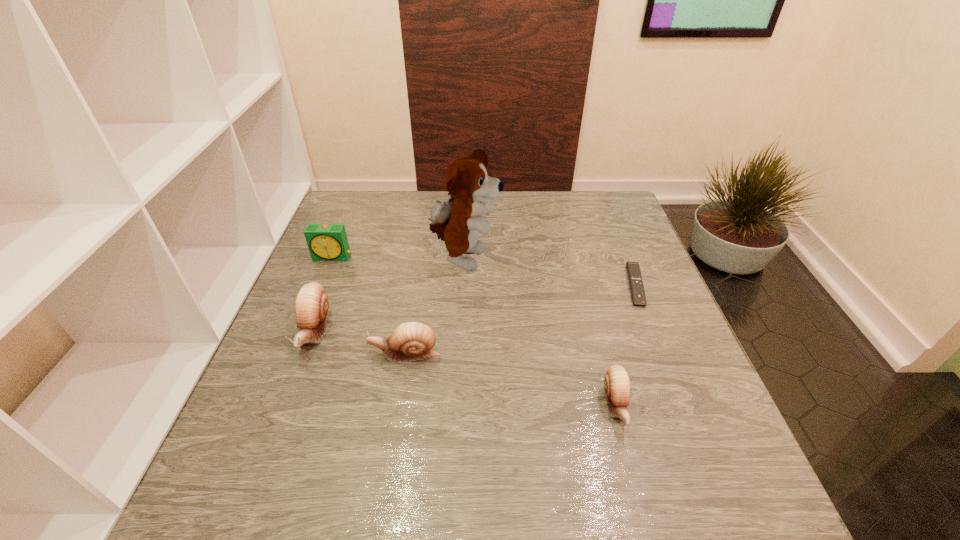
The width and height of the screenshot is (960, 540). What are the coordinates of `free space located on the front-facing side of the second escargot from left to right` in the screenshot? It's located at pyautogui.click(x=272, y=354).

Locate an element on the screen. The height and width of the screenshot is (540, 960). free space located 0.120m on the front-facing side of the second escargot from left to right is located at coordinates (314, 354).

Locate an element on the screen. free region located 0.370m on the front-facing side of the alarm clock is located at coordinates (284, 375).

Locate an element on the screen. free region located 0.200m on the face of the tallest object is located at coordinates click(x=575, y=260).

Find the location of `free location located 0.060m on the left of the remote control`. free location located 0.060m on the left of the remote control is located at coordinates (602, 286).

You are a GUI agent. You are given a task and a screenshot of the screen. Output one action in this format:
    pyautogui.click(x=<x>, y=<y>)
    Task: Click on the object that is at the near edge
    
    Given the screenshot: What is the action you would take?
    pyautogui.click(x=617, y=385)

You are a GUI agent. You are given a task and a screenshot of the screen. Output one action in this format:
    pyautogui.click(x=<x>, y=<y>)
    Task: Click on the escargot that is at the left edge
    The image size is (960, 540).
    Given the screenshot: What is the action you would take?
    pyautogui.click(x=311, y=304)

You are a GUI agent. You are given a task and a screenshot of the screen. Output one action in this format:
    pyautogui.click(x=<x>, y=<y>)
    Task: Click on the alarm clock present at the left edge
    This screenshot has width=960, height=540.
    Given the screenshot: What is the action you would take?
    pyautogui.click(x=327, y=242)

The width and height of the screenshot is (960, 540). Find the location of `object that is at the right edge`. object that is at the right edge is located at coordinates (633, 270).

You are a GUI agent. You are given a task and a screenshot of the screen. Output one action in this format:
    pyautogui.click(x=<x>, y=<y>)
    Task: Click on the blank space at the far edge
    
    Given the screenshot: What is the action you would take?
    pyautogui.click(x=528, y=208)